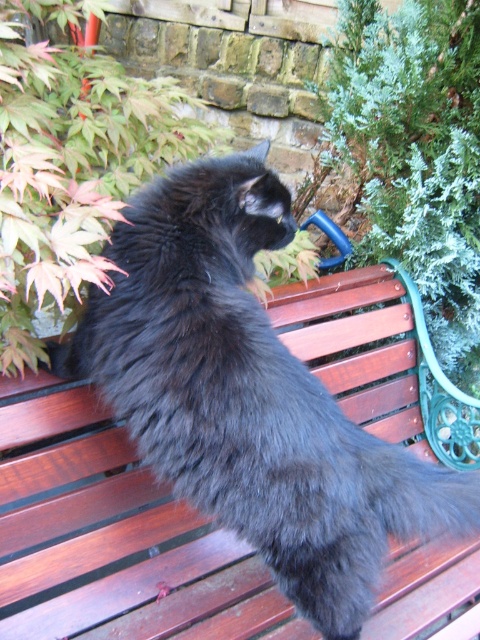
You are standing in a garden and see the black fluffy cat at center and the green leafy plant at upper left. Which object is located to the right side of the other?

The black fluffy cat at center is to the right of the green leafy plant at upper left.

You are a photographer trying to capture the black fluffy cat at center and the black fluffy tail at center in a single shot. Since you want both subjects to be clearly visible, which one should you focus on first to ensure depth of field?

You should focus on the black fluffy cat at center first because it is taller than the black fluffy tail at center, ensuring both are in focus.

Consider the image. You are a photographer trying to capture the black fluffy cat at center and its black fluffy tail at center in a single frame. Given that your camera has a maximum focus range of 8 inches, will you be able to focus on both subjects simultaneously?

The distance between the black fluffy cat at center and the black fluffy tail at center is 8.19 inches. Since the camera can only focus within 8 inches, the subjects are slightly out of range, so you won cannot focus on both simultaneously.